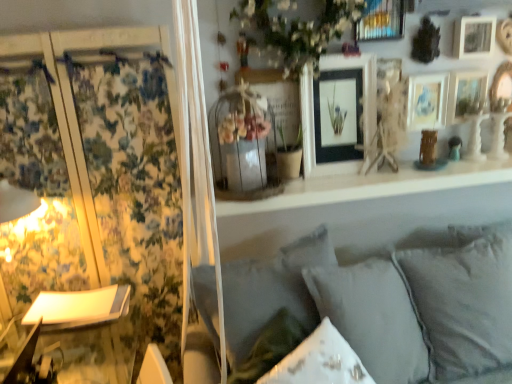
Measure the distance between point (460, 87) and camera.

A distance of 6.19 feet exists between point (460, 87) and camera.

What is the approximate height of matte white picture frame at upper right, which ranks as the second picture frame in right-to-left order?

9.49 inches.

How much space does metallic gold picture frame at upper center, the 2th picture frame positioned from the left, occupy horizontally?

metallic gold picture frame at upper center, the 2th picture frame positioned from the left, is 4.05 inches in width.

Measure the distance between point (366, 0) and camera.

Point (366, 0) and camera are 1.76 meters apart from each other.

The width and height of the screenshot is (512, 384). In order to click on gray fabric pillow at lower center, marked as the 2th pillow in a right-to-left arrangement in this screenshot , I will do `click(373, 317)`.

Locate an element on the screen. white matte flower at upper center is located at coordinates (294, 30).

What do you see at coordinates (294, 30) in the screenshot?
I see `white matte flower at upper center` at bounding box center [294, 30].

Measure the distance between point (118,341) and camera.

Point (118,341) is 1.53 meters away from camera.

The width and height of the screenshot is (512, 384). What are the coordinates of `matte black picture frame at upper center, arranged as the sixth picture frame when viewed from the right` in the screenshot? It's located at (340, 107).

At what (x,y) coordinates should I click in order to perform the action: click on matte white picture frame at upper right, which appears as the 4th picture frame when viewed from the right. Please return your answer as a coordinate pair (x, y). The image size is (512, 384). Looking at the image, I should click on (426, 101).

Which of these two, white soft pillow at lower right, the 1th pillow when ordered from right to left, or white matte flower at upper center, stands taller?

white soft pillow at lower right, the 1th pillow when ordered from right to left, is taller.

Which pillow is the 2nd one when counting from the right side of the white matte flower at upper center? Please provide its 2D coordinates.

[(463, 304)]

Could you tell me if white soft pillow at lower right, which is the 2th pillow in left-to-right order, is turned towards white matte flower at upper center?

No, white soft pillow at lower right, which is the 2th pillow in left-to-right order, is not turned towards white matte flower at upper center.

Does point (336, 262) come behind point (246, 11)?

Yes, it is behind point (246, 11).

Who is taller, white soft cushions at lower right or white matte flower at upper center?

With more height is white soft cushions at lower right.

Is white soft cushions at lower right far from white matte flower at upper center?

white soft cushions at lower right is actually quite close to white matte flower at upper center.

Is white soft cushions at lower right looking in the opposite direction of white matte flower at upper center?

No, white soft cushions at lower right is not facing the opposite direction of white matte flower at upper center.

From the image's perspective, between white soft cushions at lower right and white soft pillow at lower right, which is the 2th pillow in left-to-right order, which one is located above?

white soft pillow at lower right, which is the 2th pillow in left-to-right order, is shown above in the image.

Is white soft cushions at lower right turned away from white soft pillow at lower right, which is the 2th pillow in left-to-right order?

No, white soft pillow at lower right, which is the 2th pillow in left-to-right order, is not at the back of white soft cushions at lower right.

Locate an element on the screen. Image resolution: width=512 pixels, height=384 pixels. pillow that is the 2nd one when counting backward from the white soft cushions at lower right is located at coordinates (463, 304).

Would you say white soft pillow at lower right, which is the 2th pillow in left-to-right order, is part of white soft cushions at lower right's contents?

No, white soft pillow at lower right, which is the 2th pillow in left-to-right order, is not inside white soft cushions at lower right.

From the image's perspective, is white glossy table lamp at left below wooden picture frame at upper right, which ranks as the 1th picture frame in right-to-left order?

Correct, white glossy table lamp at left appears lower than wooden picture frame at upper right, which ranks as the 1th picture frame in right-to-left order, in the image.

Between white glossy table lamp at left and wooden picture frame at upper right, which ranks as the 1th picture frame in right-to-left order, which one appears on the right side from the viewer's perspective?

wooden picture frame at upper right, which ranks as the 1th picture frame in right-to-left order.

Who is taller, white glossy table lamp at left or wooden picture frame at upper right, which ranks as the 1th picture frame in right-to-left order?

Standing taller between the two is wooden picture frame at upper right, which ranks as the 1th picture frame in right-to-left order.

Considering the relative sizes of white glossy table lamp at left and wooden picture frame at upper right, the 6th picture frame positioned from the left, in the image provided, is white glossy table lamp at left wider than wooden picture frame at upper right, the 6th picture frame positioned from the left,?

Yes, white glossy table lamp at left is wider than wooden picture frame at upper right, the 6th picture frame positioned from the left.

Which is farther, (366, 269) or (471, 27)?

The point (471, 27) is behind.

Which object is closer to the camera taking this photo, gray fabric pillow at lower center, marked as the 2th pillow in a right-to-left arrangement, or white matte picture frame at upper right, which appears as the fourth picture frame when viewed from the left?

gray fabric pillow at lower center, marked as the 2th pillow in a right-to-left arrangement, is closer to the camera.

From the image's perspective, would you say gray fabric pillow at lower center, marked as the 2th pillow in a right-to-left arrangement, is positioned over white matte picture frame at upper right, which ranks as the 3th picture frame in right-to-left order?

Incorrect, from the image's perspective, gray fabric pillow at lower center, marked as the 2th pillow in a right-to-left arrangement, is lower than white matte picture frame at upper right, which ranks as the 3th picture frame in right-to-left order.

Can you tell me how much gray fabric pillow at lower center, the 1th pillow in the left-to-right sequence, and white matte picture frame at upper right, which ranks as the 3th picture frame in right-to-left order, differ in facing direction?

32.7 degrees.

How many degrees apart are the facing directions of white soft cushions at lower right and white matte shelf at upper center?

The angular difference between white soft cushions at lower right and white matte shelf at upper center is 0.4 degrees.

Who is taller, white soft cushions at lower right or white matte shelf at upper center?

white soft cushions at lower right.

Would you consider white soft cushions at lower right to be distant from white matte shelf at upper center?

That's not correct — white soft cushions at lower right is a little close to white matte shelf at upper center.

Find the location of a particular element. studio couch on the left side of white matte shelf at upper center is located at coordinates (388, 303).

Relative to matte white picture frame at upper right, which ranks as the second picture frame in right-to-left order, is white soft cushions at lower right in front or behind?

white soft cushions at lower right is positioned closer to the viewer than matte white picture frame at upper right, which ranks as the second picture frame in right-to-left order.

From the picture: From their relative heights in the image, would you say white soft cushions at lower right is taller or shorter than matte white picture frame at upper right, which ranks as the second picture frame in right-to-left order?

In the image, white soft cushions at lower right appears to be taller than matte white picture frame at upper right, which ranks as the second picture frame in right-to-left order.

Does white soft cushions at lower right touch matte white picture frame at upper right, the 5th picture frame viewed from the left?

No, white soft cushions at lower right is not next to matte white picture frame at upper right, the 5th picture frame viewed from the left.

From the image's perspective, is white soft cushions at lower right below matte white picture frame at upper right, the 5th picture frame viewed from the left?

Yes, from the image's perspective, white soft cushions at lower right is beneath matte white picture frame at upper right, the 5th picture frame viewed from the left.

Where is `pillow that is the 2nd object to the right of the white matte flower at upper center, starting at the anchor`? This screenshot has width=512, height=384. pillow that is the 2nd object to the right of the white matte flower at upper center, starting at the anchor is located at coordinates (463, 304).

This screenshot has width=512, height=384. In order to click on flower on the left of white soft cushions at lower right in this screenshot , I will do `click(294, 30)`.

Considering their positions, is white glossy table lamp at left positioned further to matte white picture frame at upper right, the third picture frame when ordered from left to right, than white matte picture frame at upper right, which appears as the fourth picture frame when viewed from the left?

Among the two, white glossy table lamp at left is located further to matte white picture frame at upper right, the third picture frame when ordered from left to right.

Based on the photo, looking at the image, which one is located further to matte white picture frame at upper right, which ranks as the second picture frame in right-to-left order, gray fabric pillow at lower center, the 1th pillow in the left-to-right sequence, or floral fabric curtain at left?

Answer: The object further to matte white picture frame at upper right, which ranks as the second picture frame in right-to-left order, is floral fabric curtain at left.

From the image, which object appears to be farther from white matte picture frame at upper right, which appears as the fourth picture frame when viewed from the left, white matte flower at upper center or floral fabric curtain at left?

Based on the image, floral fabric curtain at left appears to be further to white matte picture frame at upper right, which appears as the fourth picture frame when viewed from the left.

Based on their spatial positions, is white soft pillow at lower right, the 1th pillow when ordered from right to left, or matte white picture frame at upper right, which ranks as the second picture frame in right-to-left order, closer to matte white picture frame at upper right, the third picture frame when ordered from left to right?

matte white picture frame at upper right, which ranks as the second picture frame in right-to-left order, is positioned closer to the anchor matte white picture frame at upper right, the third picture frame when ordered from left to right.

Which object lies nearer to the anchor point matte white picture frame at upper right, the third picture frame when ordered from left to right, floral fabric curtain at left or metallic gold picture frame at upper center, arranged as the fifth picture frame when viewed from the right?

metallic gold picture frame at upper center, arranged as the fifth picture frame when viewed from the right, is positioned closer to the anchor matte white picture frame at upper right, the third picture frame when ordered from left to right.

Looking at the image, which one is located closer to white glossy table lamp at left, white soft pillow at lower right, the 1th pillow when ordered from right to left, or white matte shelf at upper center?

Among the two, white matte shelf at upper center is located nearer to white glossy table lamp at left.

Which object lies further to the anchor point white soft cushions at lower right, white soft pillow at lower right, which is the 2th pillow in left-to-right order, or white matte flower at upper center?

Based on the image, white matte flower at upper center appears to be further to white soft cushions at lower right.

In the scene shown: Based on their spatial positions, is matte white picture frame at upper right, which ranks as the second picture frame in right-to-left order, or white soft pillow at lower right, which is the 2th pillow in left-to-right order, closer to wooden picture frame at upper right, the 6th picture frame positioned from the left?

The object closer to wooden picture frame at upper right, the 6th picture frame positioned from the left, is matte white picture frame at upper right, which ranks as the second picture frame in right-to-left order.

At what (x,y) coordinates should I click in order to perform the action: click on pillow between white soft cushions at lower right and white soft pillow at lower right, the 1th pillow when ordered from right to left, in the horizontal direction. Please return your answer as a coordinate pair (x, y). The height and width of the screenshot is (384, 512). Looking at the image, I should click on (373, 317).

The width and height of the screenshot is (512, 384). I want to click on studio couch between white glossy table lamp at left and matte white picture frame at upper right, which appears as the 4th picture frame when viewed from the right, so click(388, 303).

In order to click on curtain between white matte flower at upper center and white glossy table lamp at left in the vertical direction in this screenshot , I will do `click(93, 189)`.

This screenshot has width=512, height=384. Find the location of `picture frame between metallic gold picture frame at upper center, arranged as the fifth picture frame when viewed from the right, and white matte picture frame at upper right, which ranks as the 3th picture frame in right-to-left order`. picture frame between metallic gold picture frame at upper center, arranged as the fifth picture frame when viewed from the right, and white matte picture frame at upper right, which ranks as the 3th picture frame in right-to-left order is located at coordinates (426, 101).